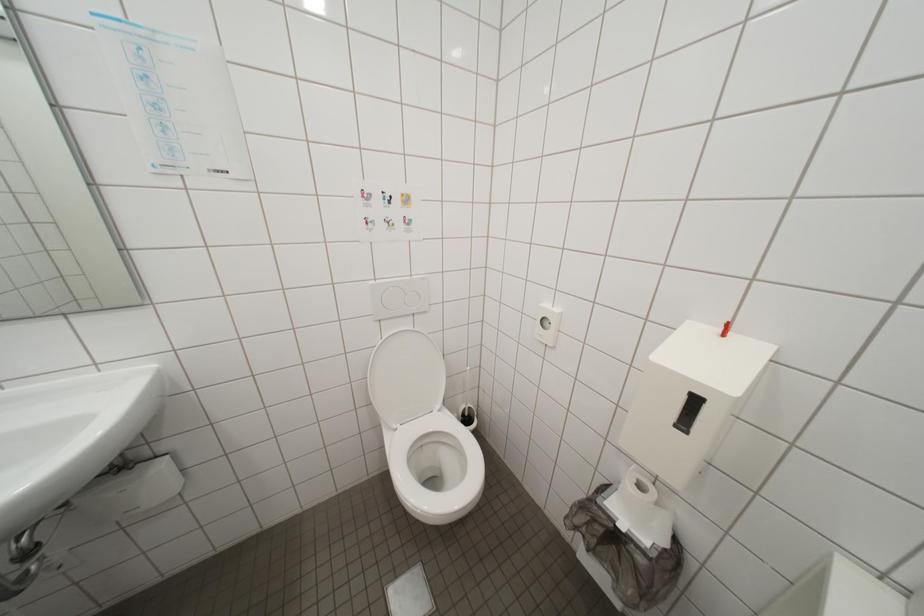
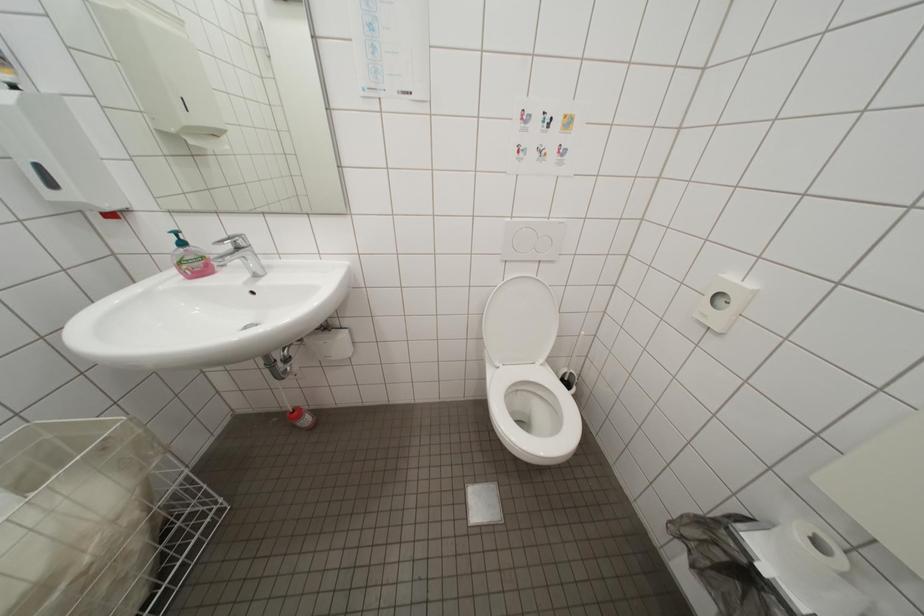
Question: In a continuous first-person perspective shot, in which direction is the camera moving?

Choices:
 (A) Left
 (B) Right
 (C) Forward
 (D) Backward

Answer: (A)